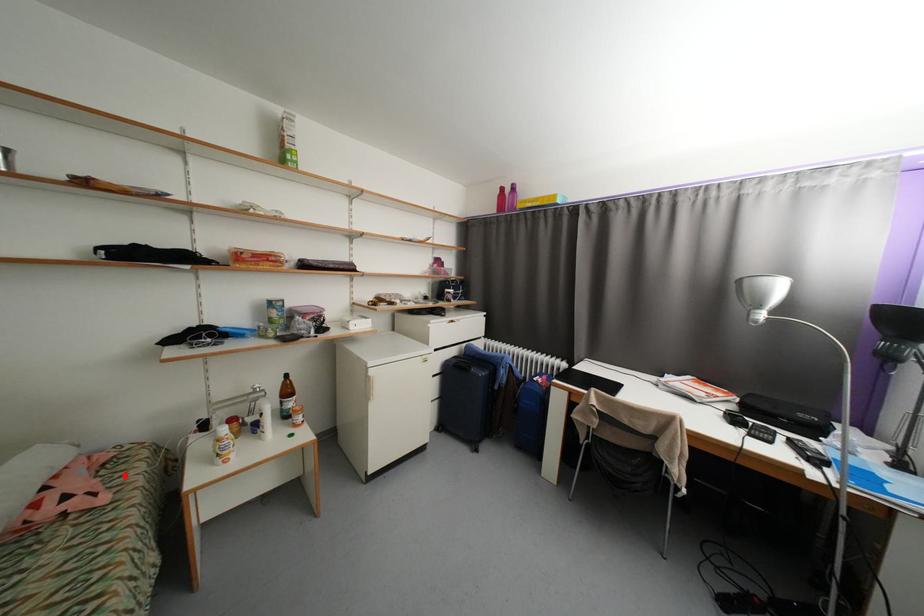
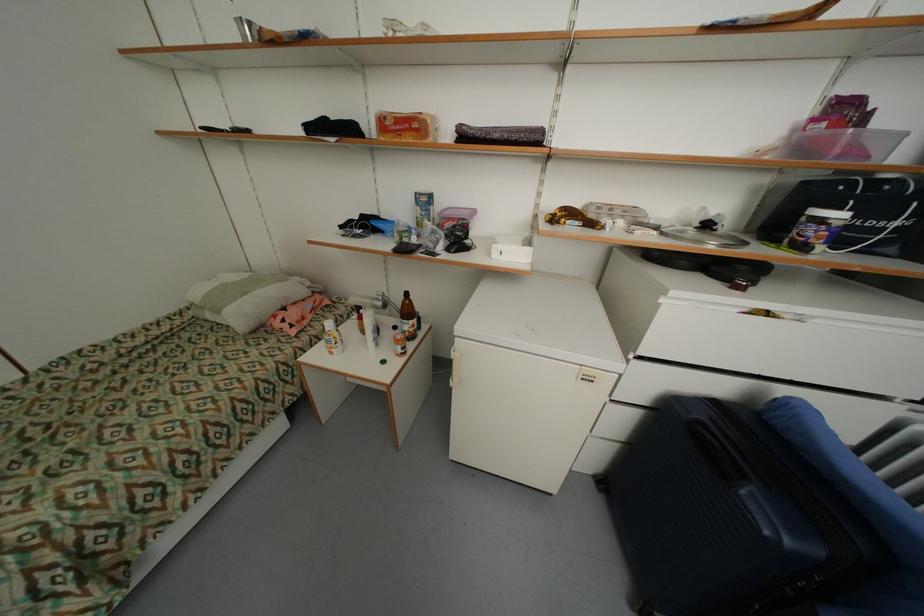
Question: I am providing you with two images of the same scene from different viewpoints. Image1 has a red point marked. In image2, the corresponding 3D location appears at what relative position? Reply with the corresponding letter.

Choices:
 (A) Closer
 (B) Farther

Answer: (B)